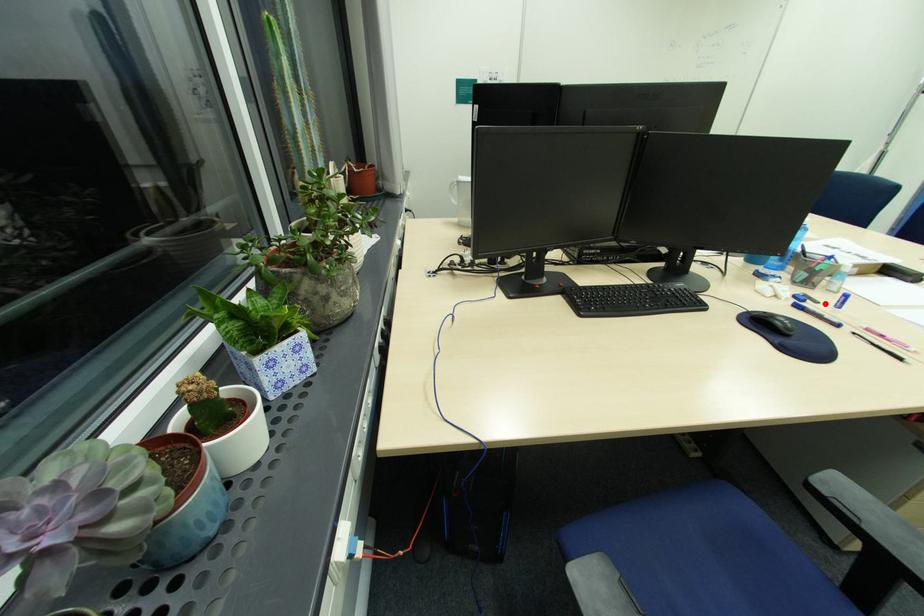
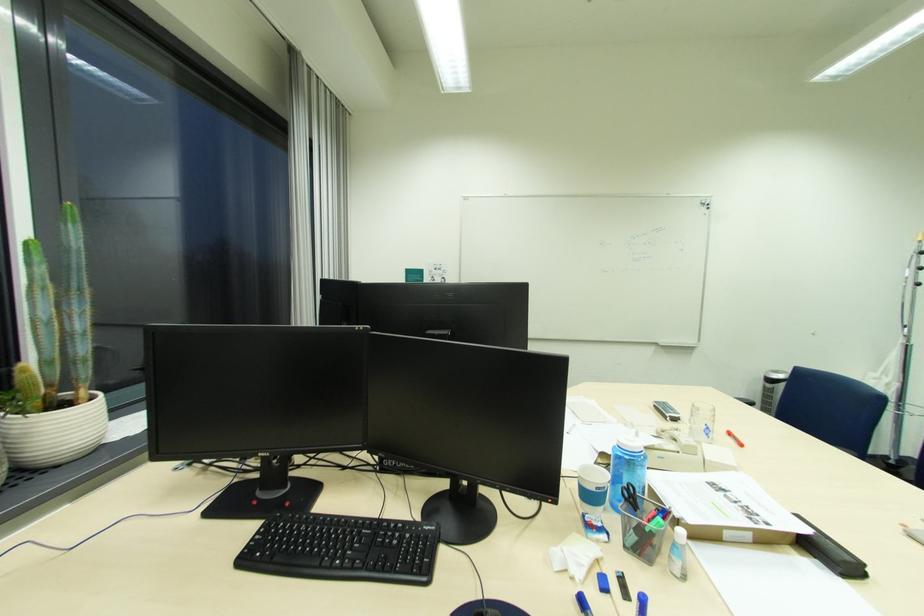
In the second image, find the point that corresponds to the highlighted location in the first image.

(636, 601)